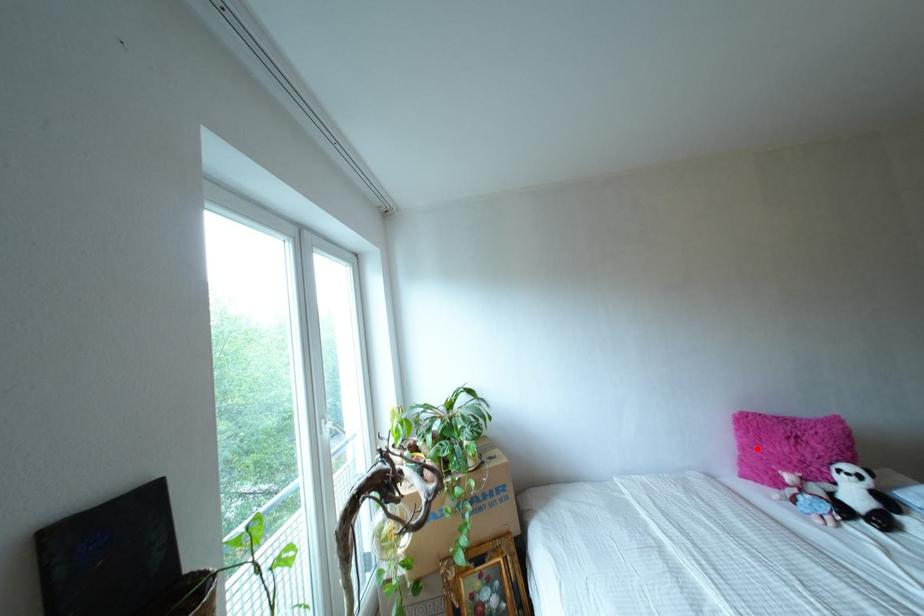
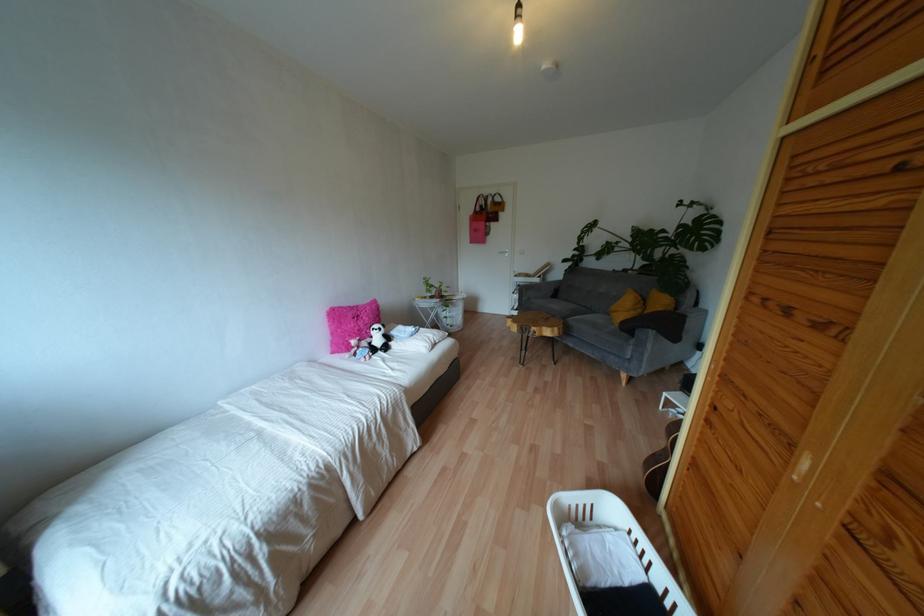
Where in the second image is the point corresponding to the highlighted location from the first image?

(338, 330)